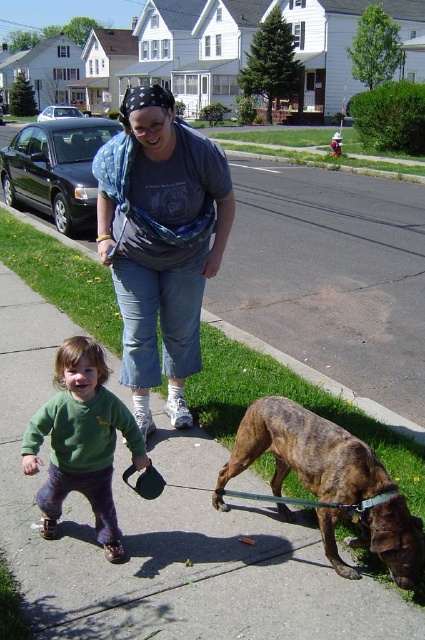
What do you see at coordinates (161, 241) in the screenshot?
I see `matte gray t-shirt at center` at bounding box center [161, 241].

Is matte gray t-shirt at center wider than green fuzzy sweater at center?

Correct, the width of matte gray t-shirt at center exceeds that of green fuzzy sweater at center.

In order to click on matte gray t-shirt at center in this screenshot , I will do `click(161, 241)`.

Where is `matte gray t-shirt at center`? Image resolution: width=425 pixels, height=640 pixels. matte gray t-shirt at center is located at coordinates (161, 241).

Is gray concrete sidewalk at lower center above green fuzzy sweater at center?

No, gray concrete sidewalk at lower center is not above green fuzzy sweater at center.

Between gray concrete sidewalk at lower center and green fuzzy sweater at center, which one is positioned higher?

green fuzzy sweater at center

Is point (178, 452) less distant than point (71, 364)?

No, it is behind (71, 364).

Where is `gray concrete sidewalk at lower center`? gray concrete sidewalk at lower center is located at coordinates (164, 532).

Based on the photo, who is more distant from viewer, (x=308, y=552) or (x=261, y=422)?

The point (x=261, y=422) is more distant.

Does point (312, 600) come in front of point (336, 518)?

Yes, it is.

Identify the location of gray concrete sidewalk at lower center. This screenshot has width=425, height=640. (164, 532).